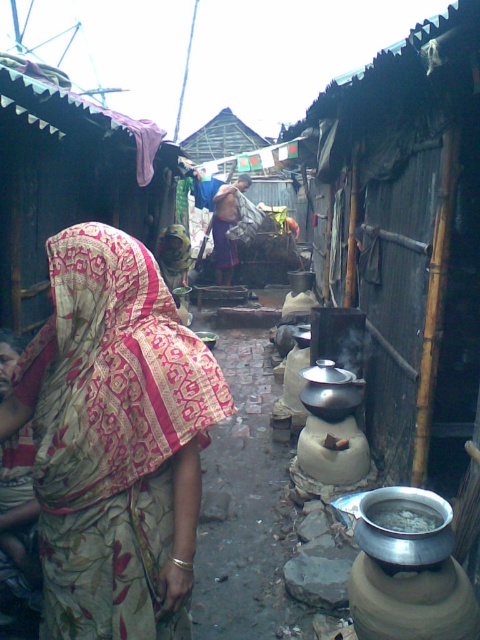
Who is more forward, [95,600] or [431,522]?

Point [95,600] is more forward.

Find the location of a particular element. The height and width of the screenshot is (640, 480). patterned silk saree at center is located at coordinates (115, 440).

Where is `patterned silk saree at center`? patterned silk saree at center is located at coordinates (115, 440).